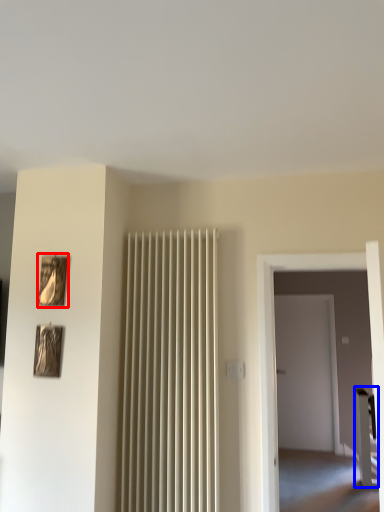
Question: Which of the following is the farthest to the observer, picture frame (highlighted by a red box) or furniture (highlighted by a blue box)?

Choices:
 (A) picture frame
 (B) furniture

Answer: (B)